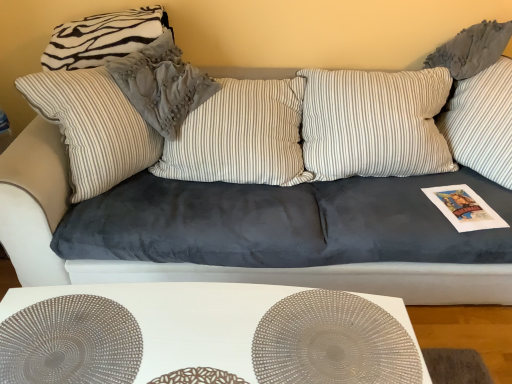
At what (x,y) coordinates should I click in order to perform the action: click on free space above translucent plastic circle at center, the 1th circle positioned from the right (from a real-world perspective). Please return your answer as a coordinate pair (x, y). Looking at the image, I should click on (332, 347).